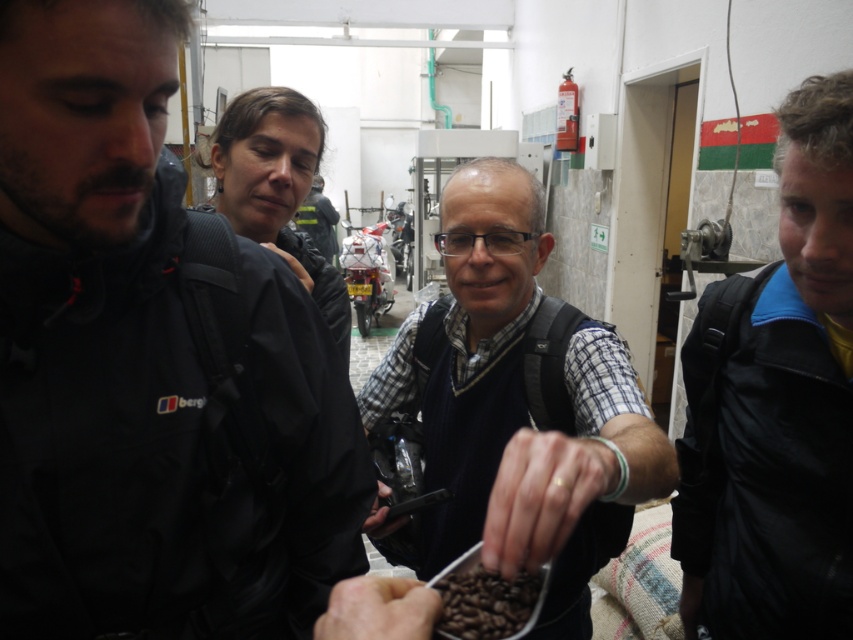
Consider the image. You are an inspector checking the placement of safety equipment in the workshop. The red fire extinguisher is mounted on the wall. Where is the matte black jacket at left in relation to the red fire extinguisher?

The matte black jacket at left is located at point (144,369), which is to the left of the red fire extinguisher mounted on the wall.

You are a safety inspector in the workshop. You notice the matte black jacket at left and the brown matte coffee beans at center. Which object is taller?

The matte black jacket at left is taller than the brown matte coffee beans at center.